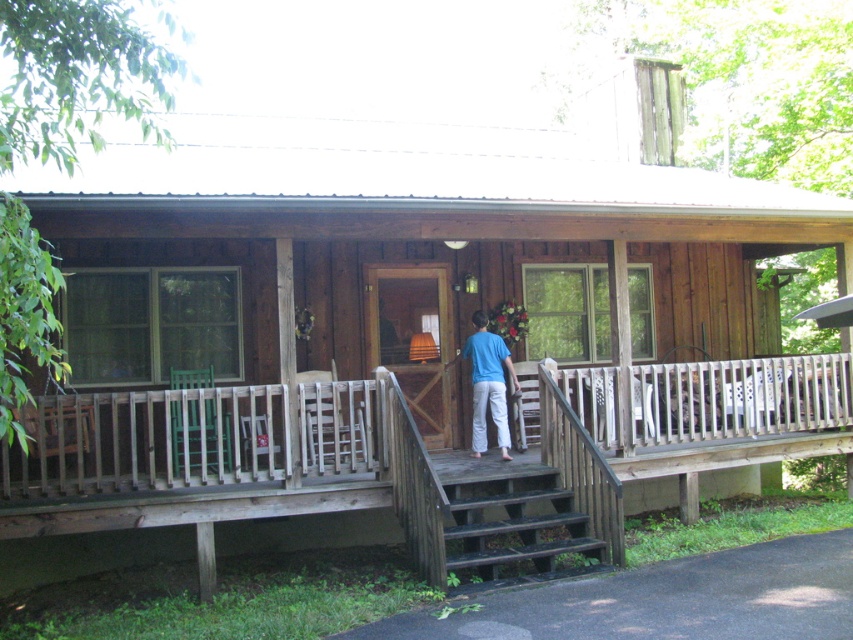
Does dark brown wooden stairs at center have a lesser width compared to blue cotton shirt at center?

No.

Identify the location of dark brown wooden stairs at center. The height and width of the screenshot is (640, 853). (509, 518).

Can you confirm if wooden porch at center is bigger than dark brown wooden stairs at center?

Yes, wooden porch at center is bigger than dark brown wooden stairs at center.

Between point (618, 470) and point (555, 488), which one is positioned in front?

Point (555, 488)

Where is `wooden porch at center`? The width and height of the screenshot is (853, 640). wooden porch at center is located at coordinates point(196,442).

Does wooden porch at center have a lesser width compared to blue cotton shirt at center?

No, wooden porch at center is not thinner than blue cotton shirt at center.

The image size is (853, 640). What do you see at coordinates (196, 442) in the screenshot?
I see `wooden porch at center` at bounding box center [196, 442].

This screenshot has height=640, width=853. I want to click on wooden porch at center, so click(x=196, y=442).